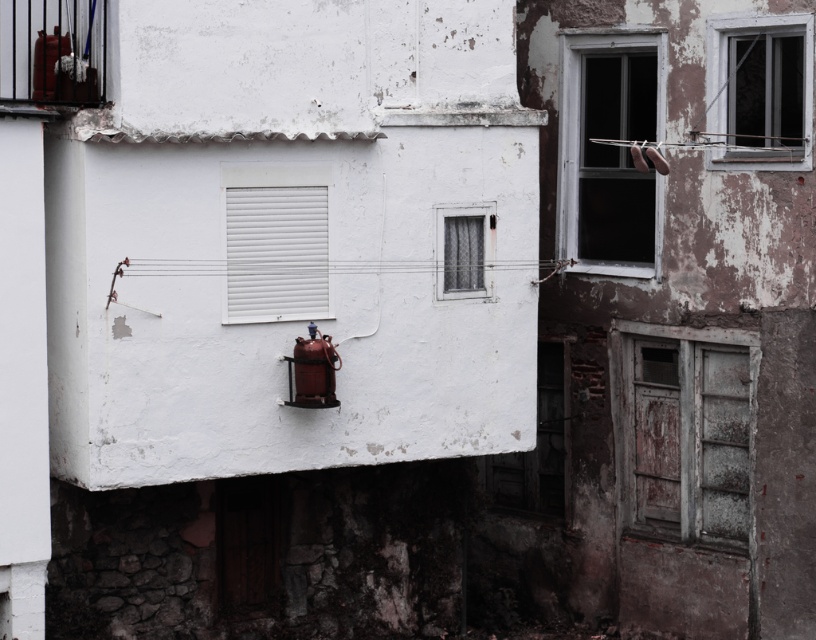
Question: Is metallic red balcony at upper left behind metallic wire at center?

Choices:
 (A) yes
 (B) no

Answer: (B)

Question: Estimate the real-world distances between objects in this image. Which object is closer to the metallic red extinguisher at center?

Choices:
 (A) clear glass window at upper right
 (B) metallic wire at center
 (C) transparent glass window at upper right
 (D) metallic red balcony at upper left

Answer: (B)

Question: Can you confirm if metallic red balcony at upper left is wider than metallic wire at center?

Choices:
 (A) no
 (B) yes

Answer: (B)

Question: Can you confirm if clear glass window at upper right is thinner than metallic red balcony at upper left?

Choices:
 (A) yes
 (B) no

Answer: (A)

Question: Which is farther from the metallic red extinguisher at center?

Choices:
 (A) clear glass window at center
 (B) metallic wire at center

Answer: (A)

Question: Which object is the closest to the metallic red balcony at upper left?

Choices:
 (A) matte red extinguisher at upper left
 (B) white matte window at center
 (C) metallic wire at center

Answer: (A)